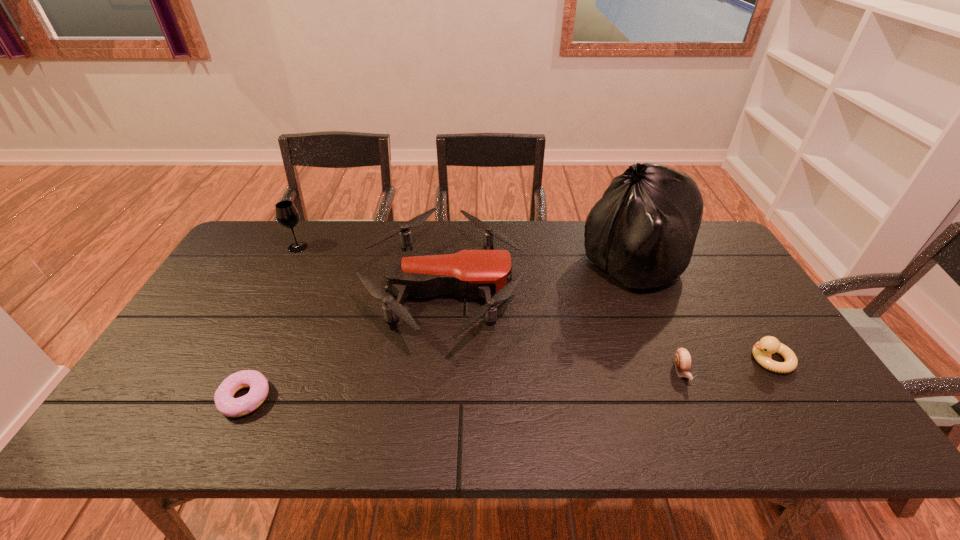
What are the coordinates of `the tallest object` in the screenshot? It's located at (642, 232).

In order to click on wineglass in this screenshot , I will do `click(287, 215)`.

I want to click on the fourth shortest object, so click(487, 273).

Find the location of a particular element. the third object from left to right is located at coordinates (487, 273).

Image resolution: width=960 pixels, height=540 pixels. I want to click on duckling, so click(x=762, y=350).

Find the location of `the rightmost object`. the rightmost object is located at coordinates (762, 350).

I want to click on the second shortest object, so click(682, 358).

This screenshot has height=540, width=960. Find the location of `doughnut`. doughnut is located at coordinates (225, 403).

This screenshot has width=960, height=540. I want to click on free space located 0.130m on the right of the tallest object, so click(x=726, y=265).

You are a GUI agent. You are given a task and a screenshot of the screen. Output one action in this format:
    pyautogui.click(x=<x>, y=<y>)
    Task: Click on the vacant space located on the right of the wineglass
    
    Given the screenshot: What is the action you would take?
    pyautogui.click(x=395, y=247)